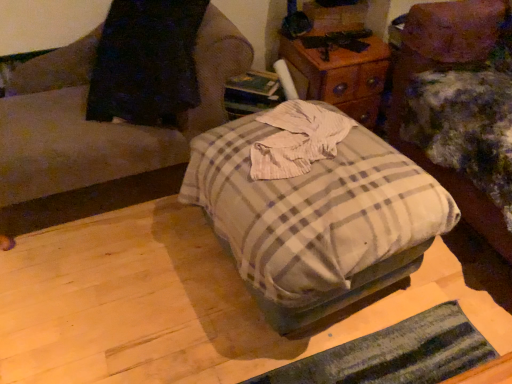
Measure the distance between point (451, 8) and camera.

1.56 meters.

The width and height of the screenshot is (512, 384). I want to click on plaid fabric ottoman at center, the first furniture viewed from the right, so click(449, 67).

Which object is positioned more to the left, plaid fabric ottoman at center, which is the 1th furniture in left-to-right order, or plaid fabric ottoman at center, arranged as the second furniture when viewed from the left?

Positioned to the left is plaid fabric ottoman at center, which is the 1th furniture in left-to-right order.

Is plaid fabric ottoman at center, which is the 1th furniture in left-to-right order, placed right next to plaid fabric ottoman at center, arranged as the second furniture when viewed from the left?

They are not placed beside each other.

Who is bigger, plaid fabric ottoman at center, the second furniture when ordered from right to left, or plaid fabric ottoman at center, the first furniture viewed from the right?

plaid fabric ottoman at center, the first furniture viewed from the right, is bigger.

Measure the distance from plaid fabric ottoman at center, the second furniture when ordered from right to left, to plaid fabric ottoman at center, the first furniture viewed from the right.

plaid fabric ottoman at center, the second furniture when ordered from right to left, and plaid fabric ottoman at center, the first furniture viewed from the right, are 1.05 meters apart.

From a real-world perspective, is wooden nightstand at upper center positioned under plaid fabric ottoman at center based on gravity?

No, from a real-world perspective, wooden nightstand at upper center is not below plaid fabric ottoman at center.

Does wooden nightstand at upper center have a lesser width compared to plaid fabric ottoman at center?

Correct, the width of wooden nightstand at upper center is less than that of plaid fabric ottoman at center.

Considering the relative sizes of wooden nightstand at upper center and plaid fabric ottoman at center in the image provided, is wooden nightstand at upper center bigger than plaid fabric ottoman at center?

Incorrect, wooden nightstand at upper center is not larger than plaid fabric ottoman at center.

Does wooden nightstand at upper center have a greater height compared to plaid fabric ottoman at center?

In fact, wooden nightstand at upper center may be shorter than plaid fabric ottoman at center.

Consider the image. Can you confirm if plaid fabric ottoman at center is smaller than wooden nightstand at upper center?

No.

Does point (320, 202) come in front of point (367, 71)?

Yes.

Measure the distance between plaid fabric ottoman at center and wooden nightstand at upper center.

A distance of 26.02 inches exists between plaid fabric ottoman at center and wooden nightstand at upper center.

In the scene shown: What's the angular difference between plaid fabric ottoman at center and wooden nightstand at upper center's facing directions?

82.5 degrees.

Consider the image. Could you measure the distance between wooden nightstand at upper center and plaid fabric ottoman at center, the first furniture viewed from the right?

wooden nightstand at upper center is 11.97 inches from plaid fabric ottoman at center, the first furniture viewed from the right.

From the image's perspective, which is below, wooden nightstand at upper center or plaid fabric ottoman at center, the first furniture viewed from the right?

plaid fabric ottoman at center, the first furniture viewed from the right, is shown below in the image.

Can you confirm if wooden nightstand at upper center is bigger than plaid fabric ottoman at center, the first furniture viewed from the right?

No.

Between wooden nightstand at upper center and plaid fabric ottoman at center, arranged as the second furniture when viewed from the left, which one has more height?

plaid fabric ottoman at center, arranged as the second furniture when viewed from the left.

Based on their sizes in the image, would you say plaid fabric ottoman at center, the first furniture viewed from the right, is bigger or smaller than wooden nightstand at upper center?

Clearly, plaid fabric ottoman at center, the first furniture viewed from the right, is larger in size than wooden nightstand at upper center.

Is plaid fabric ottoman at center, arranged as the second furniture when viewed from the left, in contact with wooden nightstand at upper center?

No, plaid fabric ottoman at center, arranged as the second furniture when viewed from the left, is not making contact with wooden nightstand at upper center.

Is point (487, 45) closer or farther from the camera than point (372, 41)?

Point (487, 45).

Measure the distance from plaid fabric ottoman at center, arranged as the second furniture when viewed from the left, to plaid fabric ottoman at center, which is the 1th furniture in left-to-right order.

They are 1.05 meters apart.

Is plaid fabric ottoman at center, the second furniture when ordered from right to left, inside plaid fabric ottoman at center, arranged as the second furniture when viewed from the left?

No, plaid fabric ottoman at center, the second furniture when ordered from right to left, is not surrounded by plaid fabric ottoman at center, arranged as the second furniture when viewed from the left.

Is plaid fabric ottoman at center, arranged as the second furniture when viewed from the left, to the left or to the right of plaid fabric ottoman at center, which is the 1th furniture in left-to-right order, in the image?

In the image, plaid fabric ottoman at center, arranged as the second furniture when viewed from the left, appears on the right side of plaid fabric ottoman at center, which is the 1th furniture in left-to-right order.

Where is `furniture above the plaid fabric ottoman at center, arranged as the second furniture when viewed from the left (from the image's perspective)`? This screenshot has height=384, width=512. furniture above the plaid fabric ottoman at center, arranged as the second furniture when viewed from the left (from the image's perspective) is located at coordinates (101, 123).

Is plaid fabric ottoman at center facing towards plaid fabric ottoman at center, the second furniture when ordered from right to left?

No, plaid fabric ottoman at center is not facing towards plaid fabric ottoman at center, the second furniture when ordered from right to left.

Is plaid fabric ottoman at center positioned before plaid fabric ottoman at center, the second furniture when ordered from right to left?

Yes.

The image size is (512, 384). I want to click on furniture to the left of plaid fabric ottoman at center, so click(x=101, y=123).

Is plaid fabric ottoman at center next to plaid fabric ottoman at center, the second furniture when ordered from right to left, and touching it?

No, plaid fabric ottoman at center is not next to plaid fabric ottoman at center, the second furniture when ordered from right to left.

This screenshot has height=384, width=512. I want to click on furniture above the plaid fabric ottoman at center, arranged as the second furniture when viewed from the left (from the image's perspective), so click(x=101, y=123).

At what (x,y) coordinates should I click in order to perform the action: click on studio couch located on the left of wooden nightstand at upper center. Please return your answer as a coordinate pair (x, y). Looking at the image, I should click on (314, 208).

Which object lies nearer to the anchor point wooden nightstand at upper center, plaid fabric ottoman at center, the second furniture when ordered from right to left, or plaid fabric ottoman at center, arranged as the second furniture when viewed from the left?

plaid fabric ottoman at center, arranged as the second furniture when viewed from the left, lies closer to wooden nightstand at upper center than the other object.

Looking at the image, which one is located closer to plaid fabric ottoman at center, arranged as the second furniture when viewed from the left, plaid fabric ottoman at center, which is the 1th furniture in left-to-right order, or plaid fabric ottoman at center?

plaid fabric ottoman at center is positioned closer to the anchor plaid fabric ottoman at center, arranged as the second furniture when viewed from the left.

Considering their positions, is wooden nightstand at upper center positioned further to plaid fabric ottoman at center, the first furniture viewed from the right, than plaid fabric ottoman at center, the second furniture when ordered from right to left?

plaid fabric ottoman at center, the second furniture when ordered from right to left, lies further to plaid fabric ottoman at center, the first furniture viewed from the right, than the other object.

Which object lies further to the anchor point plaid fabric ottoman at center, wooden nightstand at upper center or plaid fabric ottoman at center, which is the 1th furniture in left-to-right order?

wooden nightstand at upper center is positioned further to the anchor plaid fabric ottoman at center.

Which object lies further to the anchor point plaid fabric ottoman at center, plaid fabric ottoman at center, which is the 1th furniture in left-to-right order, or wooden nightstand at upper center?

wooden nightstand at upper center lies further to plaid fabric ottoman at center than the other object.

From the image, which object appears to be farther from plaid fabric ottoman at center, arranged as the second furniture when viewed from the left, plaid fabric ottoman at center or wooden nightstand at upper center?

Among the two, plaid fabric ottoman at center is located further to plaid fabric ottoman at center, arranged as the second furniture when viewed from the left.

Based on their spatial positions, is plaid fabric ottoman at center, arranged as the second furniture when viewed from the left, or plaid fabric ottoman at center further from wooden nightstand at upper center?

plaid fabric ottoman at center lies further to wooden nightstand at upper center than the other object.

Considering their positions, is wooden nightstand at upper center positioned closer to plaid fabric ottoman at center than plaid fabric ottoman at center, the first furniture viewed from the right?

plaid fabric ottoman at center, the first furniture viewed from the right, is closer to plaid fabric ottoman at center.

Identify the location of studio couch located between plaid fabric ottoman at center, which is the 1th furniture in left-to-right order, and wooden nightstand at upper center in the left-right direction. (314, 208).

Image resolution: width=512 pixels, height=384 pixels. I want to click on studio couch located between plaid fabric ottoman at center, the first furniture viewed from the right, and wooden nightstand at upper center in the depth direction, so click(314, 208).

What are the coordinates of `studio couch between plaid fabric ottoman at center, the second furniture when ordered from right to left, and plaid fabric ottoman at center, the first furniture viewed from the right, in the horizontal direction` in the screenshot? It's located at (314, 208).

Locate an element on the screen. The height and width of the screenshot is (384, 512). nightstand between plaid fabric ottoman at center, which is the 1th furniture in left-to-right order, and plaid fabric ottoman at center, the first furniture viewed from the right, in the horizontal direction is located at coordinates (340, 76).